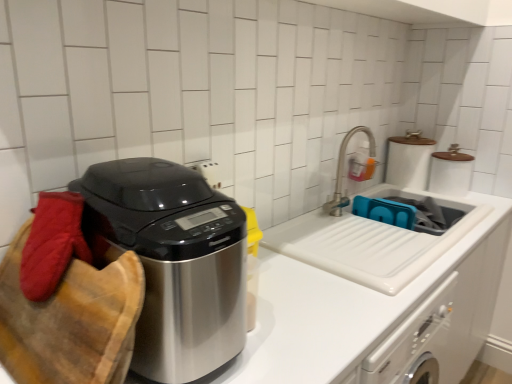
Locate an element on the screen. The width and height of the screenshot is (512, 384). free space above polished stainless steel appliance at left (from a real-world perspective) is located at coordinates (142, 170).